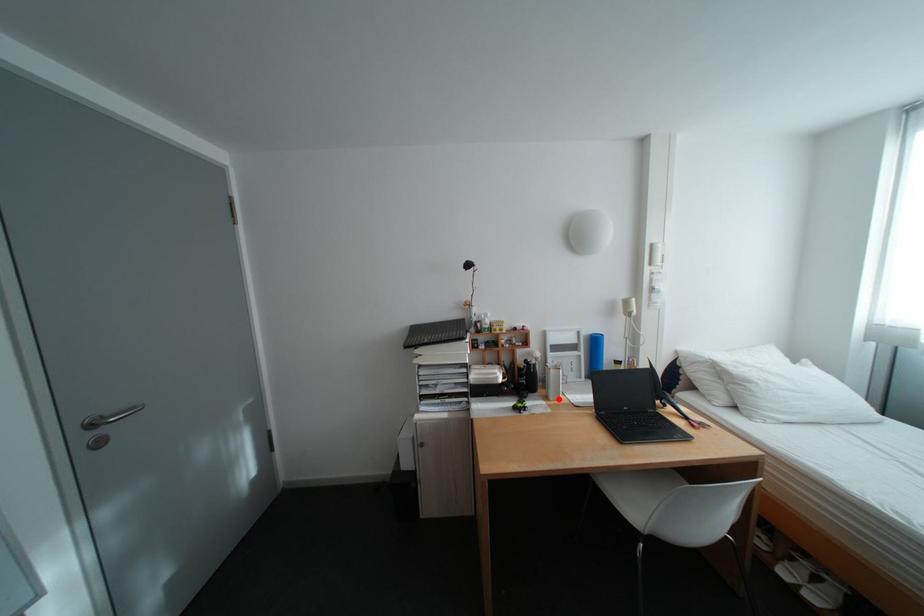
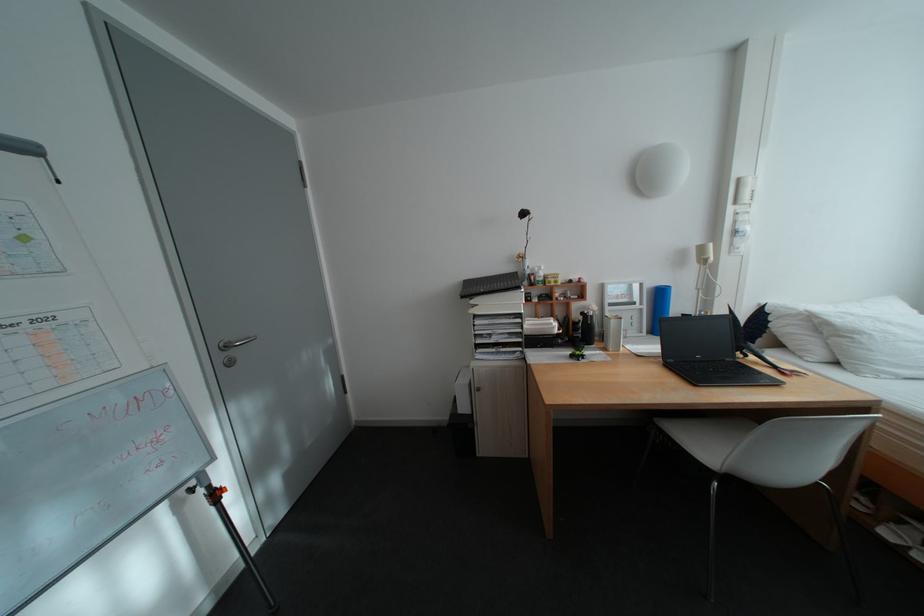
Where in the second image is the point corresponding to the highlighted location from the first image?

(617, 350)